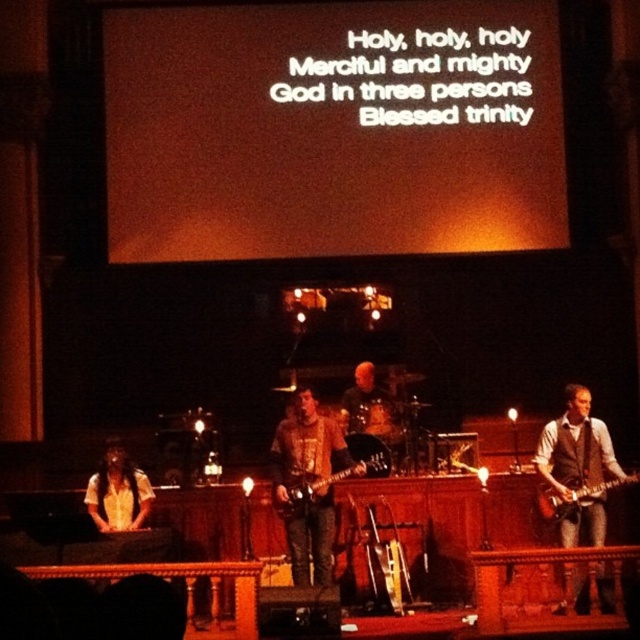
Can you confirm if brown leather guitar at center is positioned above white shirt at lower left?

Correct, brown leather guitar at center is located above white shirt at lower left.

Is point (301, 481) farther from camera compared to point (134, 518)?

No, it is in front of (134, 518).

Does point (294, 504) lie behind point (106, 461)?

That is False.

The height and width of the screenshot is (640, 640). In order to click on brown leather guitar at center in this screenshot , I will do `click(308, 484)`.

Between brown leather vest at right and glossy electric guitar at right, which one appears on the right side from the viewer's perspective?

Positioned to the right is glossy electric guitar at right.

Is brown leather vest at right to the left of glossy electric guitar at right from the viewer's perspective?

Yes, brown leather vest at right is to the left of glossy electric guitar at right.

Is point (554, 454) farther from camera compared to point (564, 516)?

Yes, it is behind point (564, 516).

Where is `brown leather vest at right`? brown leather vest at right is located at coordinates (579, 468).

Is brown leather guitar at center smaller than glossy electric guitar at center?

Actually, brown leather guitar at center might be larger than glossy electric guitar at center.

Does point (324, 464) come closer to viewer compared to point (304, 499)?

No, it is behind (304, 499).

Identify the location of brown leather guitar at center. (308, 484).